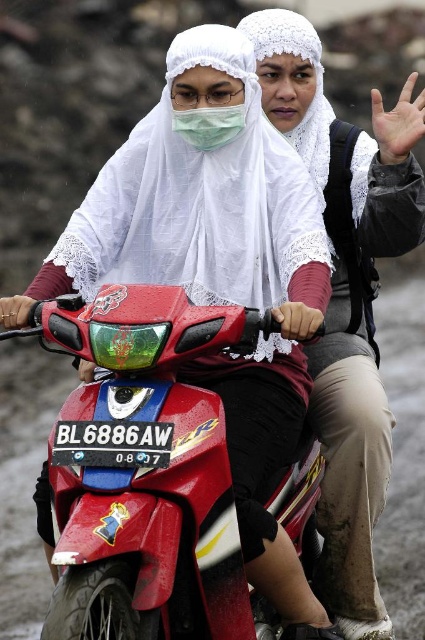
Identify the location of white lace hijab at center. (362, 364).

Which is in front, point (328, 204) or point (201, 115)?

Positioned in front is point (201, 115).

What do you see at coordinates (362, 364) in the screenshot?
I see `white lace hijab at center` at bounding box center [362, 364].

Identify the location of white lace hijab at center. The width and height of the screenshot is (425, 640). (362, 364).

Is shiny red motorcycle at center smaller than green matte mask at center?

No.

I want to click on shiny red motorcycle at center, so click(146, 472).

Between shiny red motorcycle at center and white lace hijab at center, which one has more height?

Standing taller between the two is white lace hijab at center.

Which of these two, shiny red motorcycle at center or white lace hijab at center, stands shorter?

Standing shorter between the two is shiny red motorcycle at center.

At what (x,y) coordinates should I click in order to perform the action: click on shiny red motorcycle at center. Please return your answer as a coordinate pair (x, y). Image resolution: width=425 pixels, height=640 pixels. Looking at the image, I should click on (146, 472).